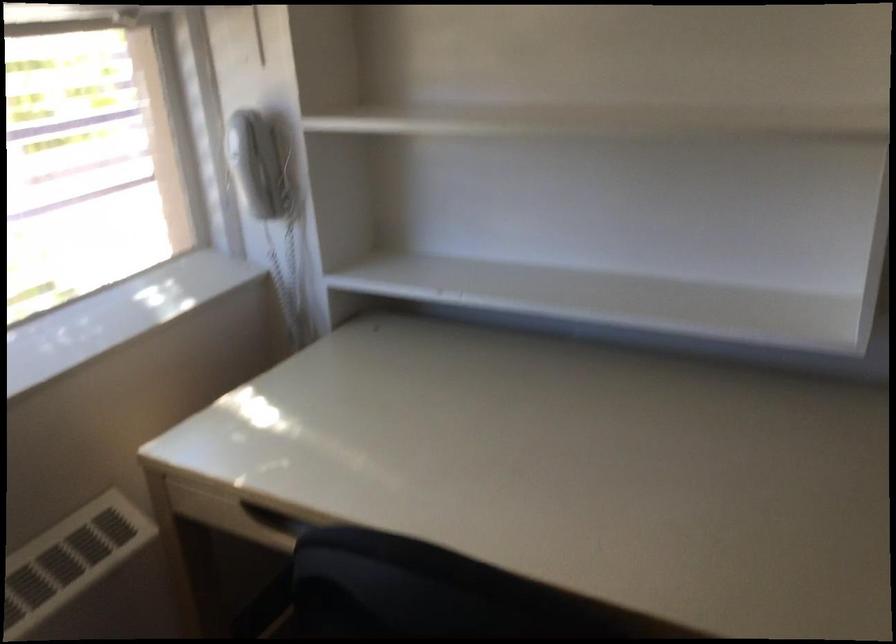
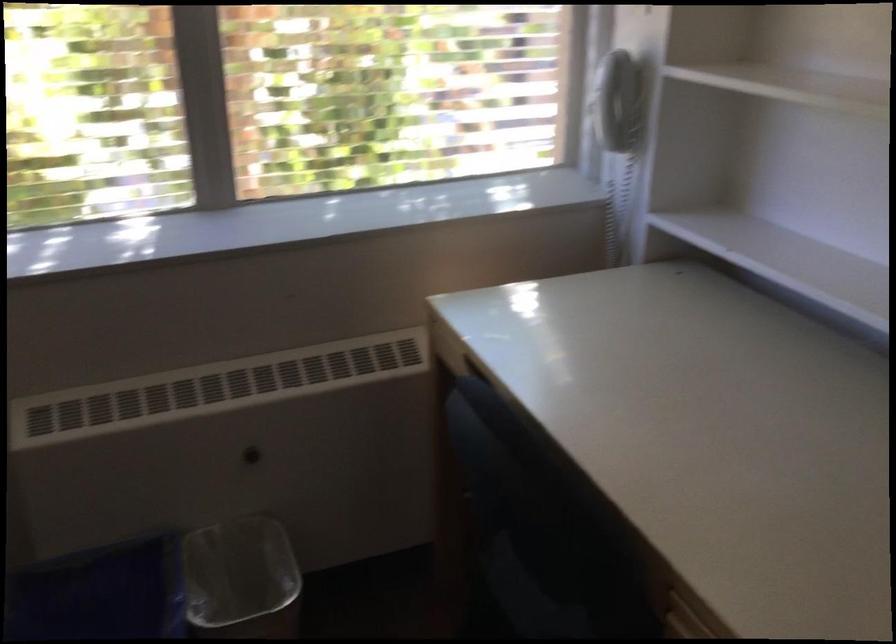
Question: The camera is either moving clockwise (left) or counter-clockwise (right) around the object. The first image is from the beginning of the video and the second image is from the end. Is the camera moving left or right when shooting the video?

Choices:
 (A) Left
 (B) Right

Answer: (B)